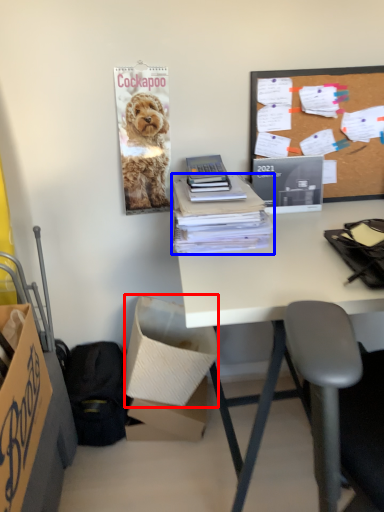
Question: Which object appears farthest to the camera in this image, box (highlighted by a red box) or office supplies (highlighted by a blue box)?

Choices:
 (A) box
 (B) office supplies

Answer: (A)